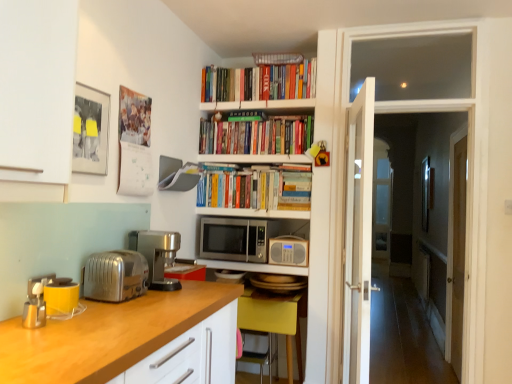
At what (x,y) coordinates should I click in order to perform the action: click on free spot above hardcover books at upper center, which ranks as the second book in top-to-bottom order (from a real-world perspective). Please return your answer as a coordinate pair (x, y). The height and width of the screenshot is (384, 512). Looking at the image, I should click on (253, 107).